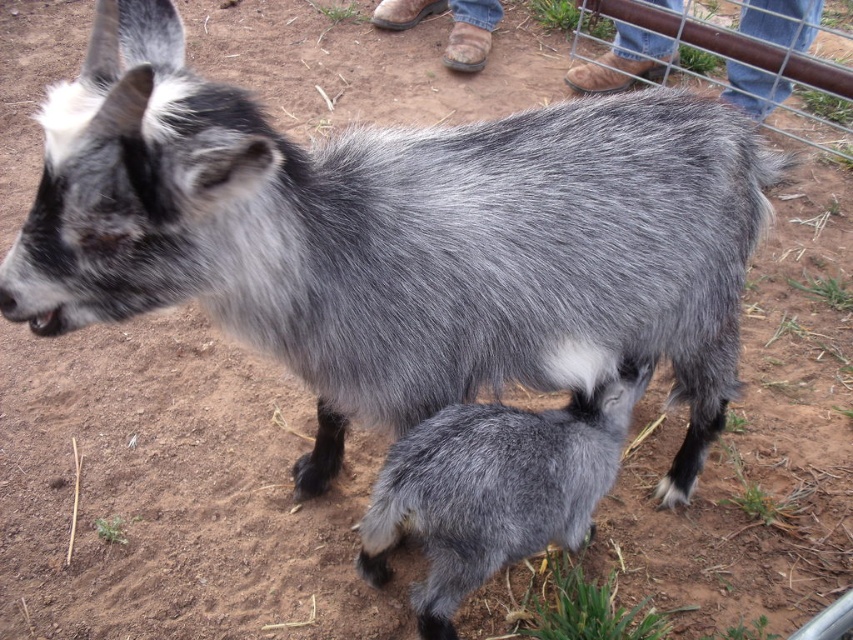
You are a farmer checking the pasture. You notice the gray woolen goat at lower center and the metal wire fence at upper right. Which object is narrower in width?

The gray woolen goat at lower center is narrower in width compared to the metal wire fence at upper right.

You are a farmer checking the goats in the pasture. You notice the gray woolen goat at lower center. Where exactly is this goat positioned in relation to the other goat?

The gray woolen goat at lower center is positioned above the smaller goat, which is nursing underneath it, as indicated by their spatial arrangement in the image.